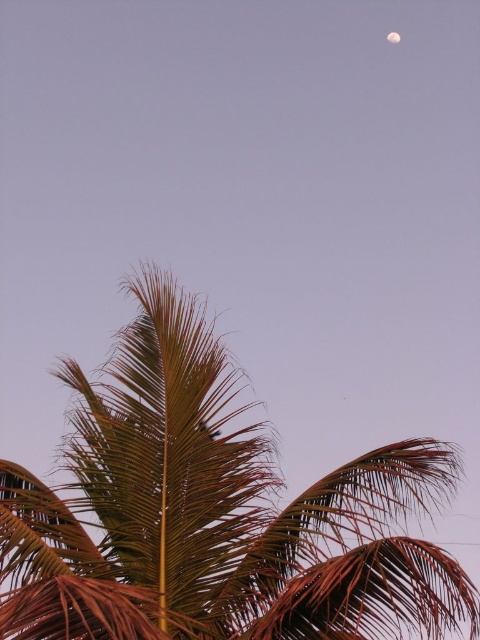
You are an astronomer observing the night sky. You notice the brown leafy coconut tree at upper center and the smooth gray moon at upper right. Which object occupies more horizontal space in the image?

The brown leafy coconut tree at upper center might be wider than the smooth gray moon at upper right according to the description.

You are standing in the serene scene with the palm tree fronds and the small bright moon in the upper right corner. You want to place a small birdhouse exactly at point (215, 513). Is there already an object at that point?

Yes, there is already a brown leafy coconut tree at upper center located at point (215, 513), so you cannot place the birdhouse there.